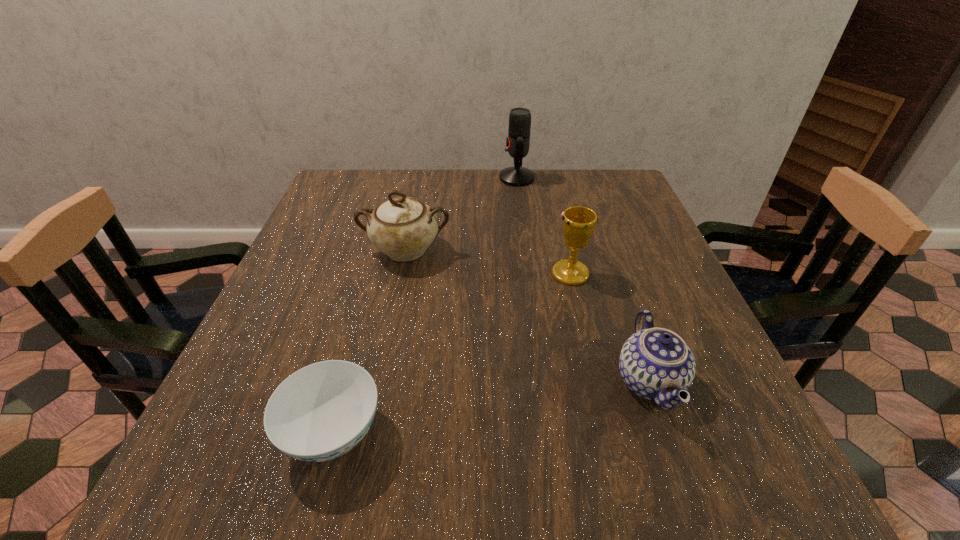
You are a GUI agent. You are given a task and a screenshot of the screen. Output one action in this format:
    pyautogui.click(x=<x>, y=<y>)
    Task: Click on the free space at the far edge
    This screenshot has height=540, width=960.
    Given the screenshot: What is the action you would take?
    pyautogui.click(x=483, y=203)

Where is `vacant space at the near edge of the desktop`? The width and height of the screenshot is (960, 540). vacant space at the near edge of the desktop is located at coordinates (347, 475).

In the image, there is a desktop. At what (x,y) coordinates should I click in order to perform the action: click on vacant region at the left edge. Please return your answer as a coordinate pair (x, y). Image resolution: width=960 pixels, height=540 pixels. Looking at the image, I should click on (305, 292).

Locate an element on the screen. vacant area at the right edge is located at coordinates (658, 262).

The height and width of the screenshot is (540, 960). What are the coordinates of `vacant space at the far left corner of the desktop` in the screenshot? It's located at (331, 191).

Locate an element on the screen. vacant space at the near left corner of the desktop is located at coordinates pyautogui.click(x=236, y=486).

This screenshot has width=960, height=540. What are the coordinates of `vacant point at the far right corner` in the screenshot? It's located at click(610, 172).

Where is `unoccupied position between the chalice and the farthest chinaware`? unoccupied position between the chalice and the farthest chinaware is located at coordinates (488, 262).

Where is `free space between the rightmost chinaware and the tallest chinaware`? The width and height of the screenshot is (960, 540). free space between the rightmost chinaware and the tallest chinaware is located at coordinates (528, 316).

Locate an element on the screen. vacant space that's between the shortest chinaware and the second tallest chinaware is located at coordinates (492, 408).